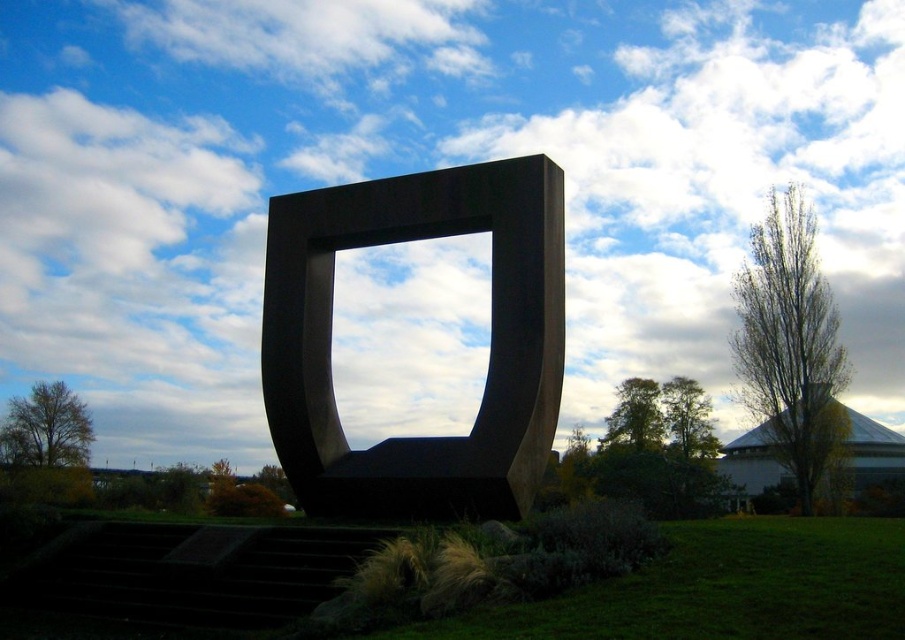
The image size is (905, 640). What do you see at coordinates (489, 344) in the screenshot?
I see `black polished stone sculpture at center` at bounding box center [489, 344].

Who is positioned more to the right, black polished stone sculpture at center or green grass at lower center?

green grass at lower center is more to the right.

Locate an element on the screen. The image size is (905, 640). black polished stone sculpture at center is located at coordinates (489, 344).